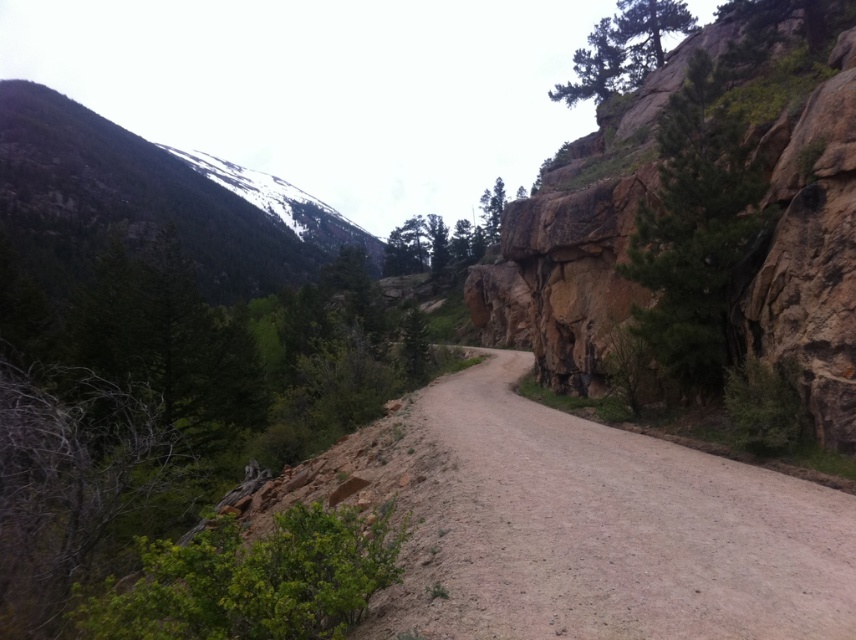
Does green rough textured tree at right have a lesser width compared to green matte tree at center?

Correct, green rough textured tree at right's width is less than green matte tree at center's.

The height and width of the screenshot is (640, 856). In order to click on green rough textured tree at right in this screenshot , I will do `click(694, 232)`.

Can you confirm if green leafy bush at lower left is positioned above green matte tree at center?

Incorrect, green leafy bush at lower left is not positioned above green matte tree at center.

Which is behind, point (325, 614) or point (428, 252)?

Positioned behind is point (428, 252).

In order to click on green leafy bush at lower left in this screenshot , I will do `click(254, 580)`.

Locate an element on the screen. green rough bark tree at upper right is located at coordinates (622, 49).

Is point (651, 51) positioned after point (484, 211)?

No.

Where is `green rough bark tree at upper right`? Image resolution: width=856 pixels, height=640 pixels. green rough bark tree at upper right is located at coordinates (622, 49).